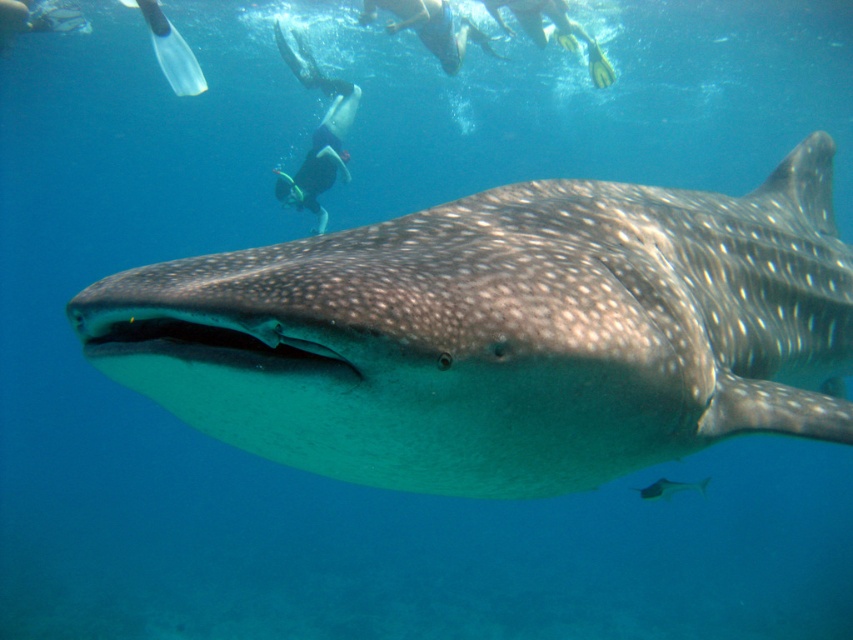
What do you see at coordinates (503, 333) in the screenshot? This screenshot has height=640, width=853. I see `speckled skin shark at center` at bounding box center [503, 333].

Does point (376, 298) come behind point (654, 497)?

No, it is not.

Which is behind, point (628, 252) or point (657, 480)?

Positioned behind is point (657, 480).

This screenshot has height=640, width=853. I want to click on speckled skin shark at center, so click(x=503, y=333).

Is black wetsuit at center closer to camera compared to shiny silver fish at center?

That is False.

Between black wetsuit at center and shiny silver fish at center, which one appears on the right side from the viewer's perspective?

shiny silver fish at center

Does point (302, 204) lie in front of point (665, 486)?

No, (302, 204) is further to viewer.

This screenshot has width=853, height=640. I want to click on black wetsuit at center, so click(317, 132).

Does black wetsuit at center come behind black wetsuit at upper center?

No, black wetsuit at center is in front of black wetsuit at upper center.

Which is in front, point (334, 148) or point (460, 49)?

Point (334, 148) is in front.

Does point (311, 77) lie in front of point (397, 28)?

No, (311, 77) is behind (397, 28).

Image resolution: width=853 pixels, height=640 pixels. What are the coordinates of `black wetsuit at center` in the screenshot? It's located at (317, 132).